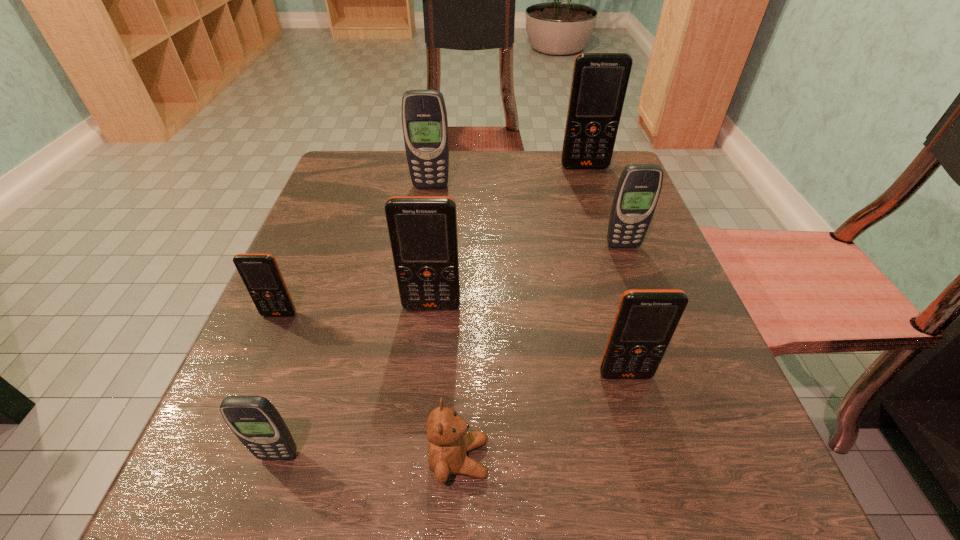
Image resolution: width=960 pixels, height=540 pixels. Find the location of `free space at the right edge of the desktop`. free space at the right edge of the desktop is located at coordinates coord(679,436).

The image size is (960, 540). I want to click on vacant area at the far left corner of the desktop, so click(x=374, y=181).

The height and width of the screenshot is (540, 960). In the image, there is a desktop. Identify the location of vacant space at the near right corner. (679, 484).

Where is `free spot between the nearest gray cellular telephone and the fifth nearest cellular telephone`? free spot between the nearest gray cellular telephone and the fifth nearest cellular telephone is located at coordinates (450, 350).

Locate an element on the screen. Image resolution: width=960 pixels, height=540 pixels. free spot between the second nearest cellular telephone and the leftmost cellular telephone is located at coordinates (452, 345).

I want to click on vacant region between the second orange cellular telephone from left to right and the shortest object, so click(445, 382).

Identify the location of free area in between the sixth farthest object and the leftmost orange cellular telephone. This screenshot has width=960, height=540. (452, 345).

In order to click on vacant point located between the sixth nearest cellular telephone and the brown teddy bear in this screenshot , I will do `click(444, 322)`.

Image resolution: width=960 pixels, height=540 pixels. What are the coordinates of `vacant space that's between the brown teddy bear and the smallest gray cellular telephone` in the screenshot? It's located at (369, 457).

Locate an element on the screen. free space that is in between the third farthest cellular telephone and the farthest gray cellular telephone is located at coordinates (527, 216).